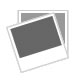
Where is `poloroid photos`? This screenshot has height=80, width=80. poloroid photos is located at coordinates (27, 15), (35, 32).